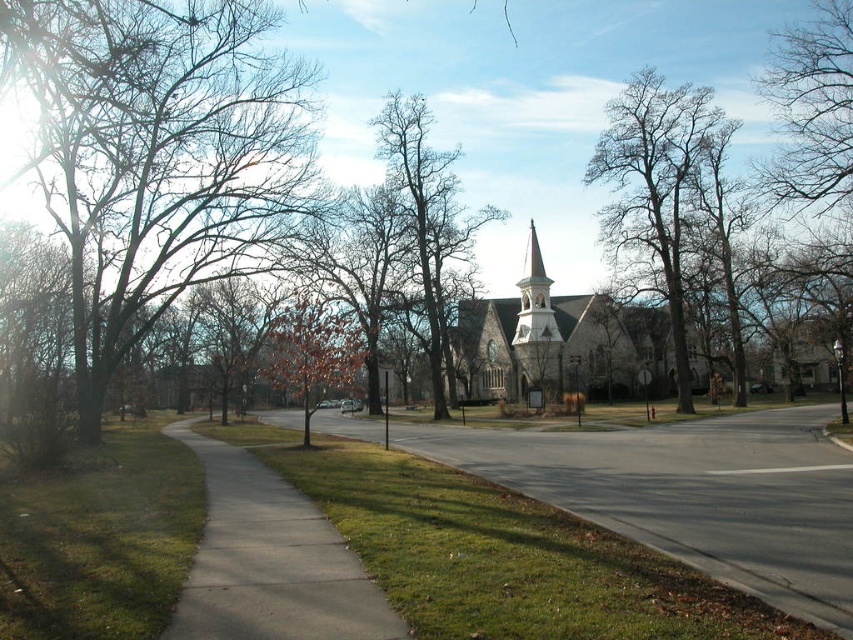
You are standing on the concrete sidewalk at center and want to walk towards the bare wood tree at center. Which direction should you move to get closer to the tree?

Since the concrete sidewalk at center is closer to the viewer than the bare wood tree at center, you should move forward along the sidewalk towards the tree to get closer to it.

You are a delivery person with a cart that is 1.2 meters wide. You need to navigate through the sidewalk in the image. Can your cart fit on the gray asphalt sidewalk at center or the concrete sidewalk at center?

The gray asphalt sidewalk at center might be wider than concrete sidewalk at center, so it is possible that the gray asphalt sidewalk at center can accommodate the 1.2 meter wide cart, but the concrete sidewalk at center may be too narrow. Check the width before proceeding.

You are walking along the gray asphalt sidewalk at center and want to reach the bare wood tree at center. Which direction should you turn to face the tree?

You should turn to your left because the gray asphalt sidewalk at center is to the right of the bare wood tree at center, meaning the tree is to your left relative to your position on the sidewalk.